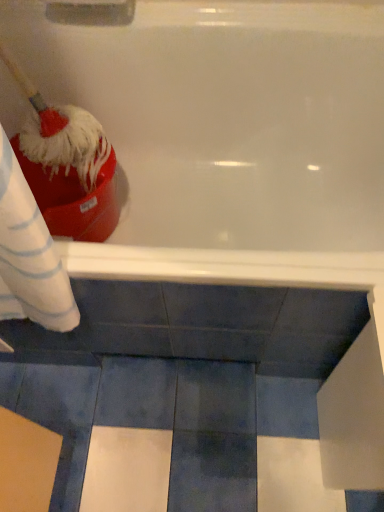
Question: Is white glossy bathtub at upper center taller or shorter than red fluffy brush at left?

Choices:
 (A) tall
 (B) short

Answer: (A)

Question: From a real-world perspective, is white glossy bathtub at upper center positioned above or below red fluffy brush at left?

Choices:
 (A) below
 (B) above

Answer: (A)

Question: From the image's perspective, is white glossy bathtub at upper center above or below red fluffy brush at left?

Choices:
 (A) above
 (B) below

Answer: (B)

Question: Based on their positions, is red fluffy brush at left located to the left or right of white glossy bathtub at upper center?

Choices:
 (A) left
 (B) right

Answer: (A)

Question: Do you think red fluffy brush at left is within white glossy bathtub at upper center, or outside of it?

Choices:
 (A) outside
 (B) inside

Answer: (B)

Question: Relative to white glossy bathtub at upper center, is red fluffy brush at left in front or behind?

Choices:
 (A) behind
 (B) front

Answer: (B)

Question: From their relative heights in the image, would you say red fluffy brush at left is taller or shorter than white glossy bathtub at upper center?

Choices:
 (A) tall
 (B) short

Answer: (B)